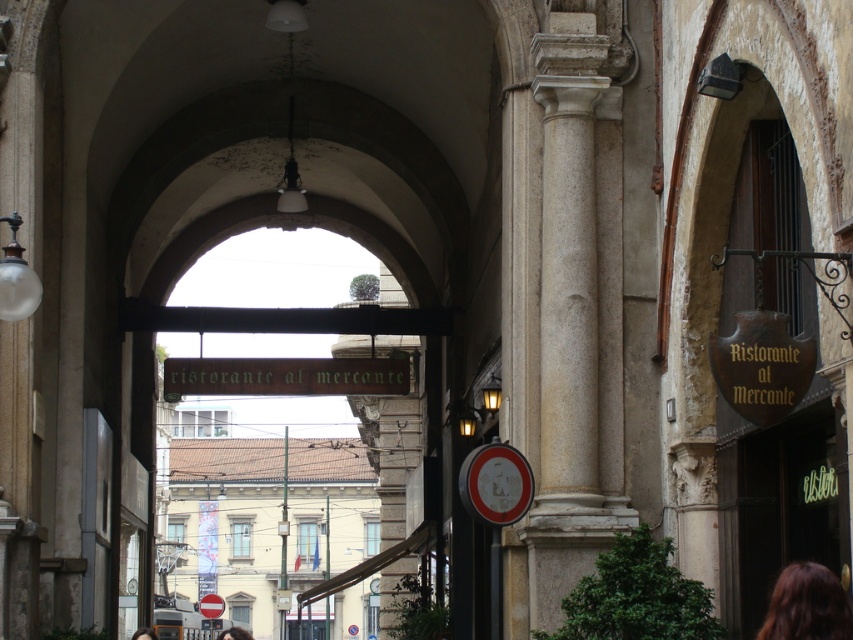
Who is more forward, (846, 627) or (136, 634)?

Point (846, 627)

Does brown hair at lower right have a greater width compared to blonde hair at lower center?

No.

This screenshot has width=853, height=640. In order to click on brown hair at lower right in this screenshot , I will do `click(807, 605)`.

Which is behind, point (758, 602) or point (141, 637)?

Positioned behind is point (141, 637).

Is point (778, 561) positioned behind point (131, 637)?

No.

Describe the element at coordinates (782, 509) in the screenshot. Image resolution: width=853 pixels, height=640 pixels. I see `green neon sign at lower right` at that location.

Find the location of a particular element. Image resolution: width=853 pixels, height=640 pixels. green neon sign at lower right is located at coordinates (782, 509).

You are a GUI agent. You are given a task and a screenshot of the screen. Output one action in this format:
    pyautogui.click(x=<x>, y=<y>)
    Task: Click on the white marble column at center
    
    Given the screenshot: What is the action you would take?
    577,310

Does white marble column at center have a lesser width compared to dark brown hair at lower center?

Yes, white marble column at center is thinner than dark brown hair at lower center.

Who is more forward, (608, 348) or (225, 636)?

Point (608, 348) is in front.

Identify the location of white marble column at center. (577, 310).